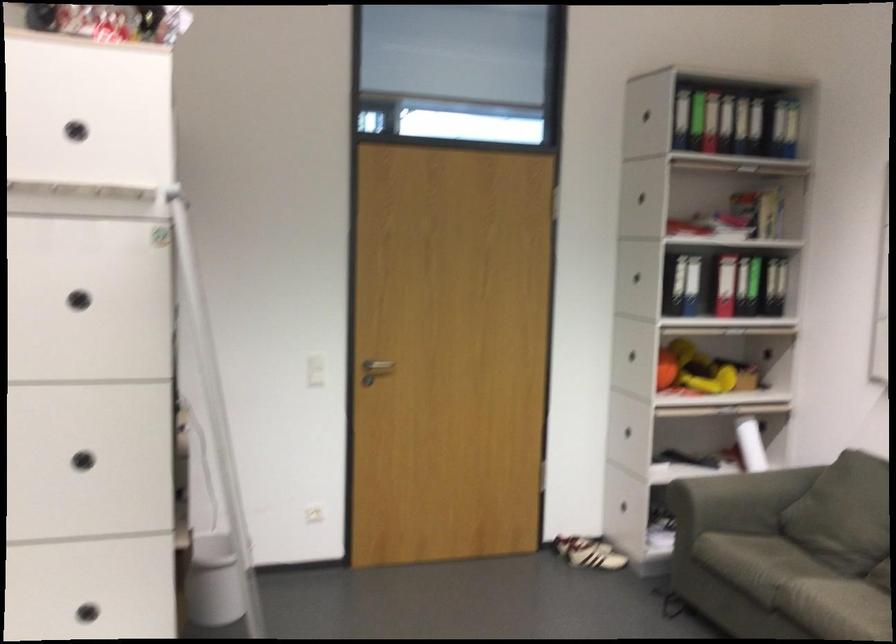
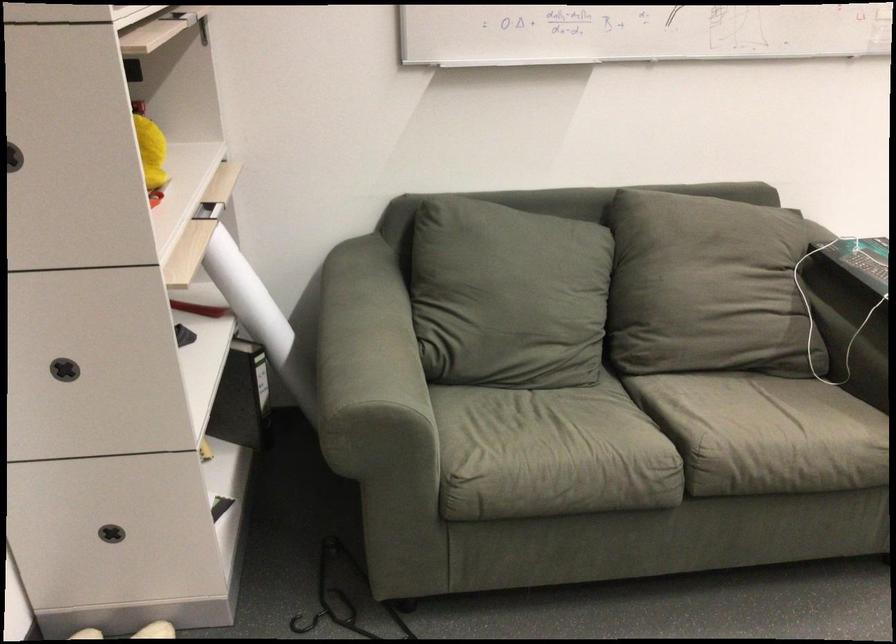
Question: I am providing you with two images of the same scene from different viewpoints. After the viewpoint changes to image2, which objects are now occluded?

Choices:
 (A) white paper roll
 (B) glass and metal lantern
 (C) sofa armrest
 (D) rolled white paper

Answer: (D)